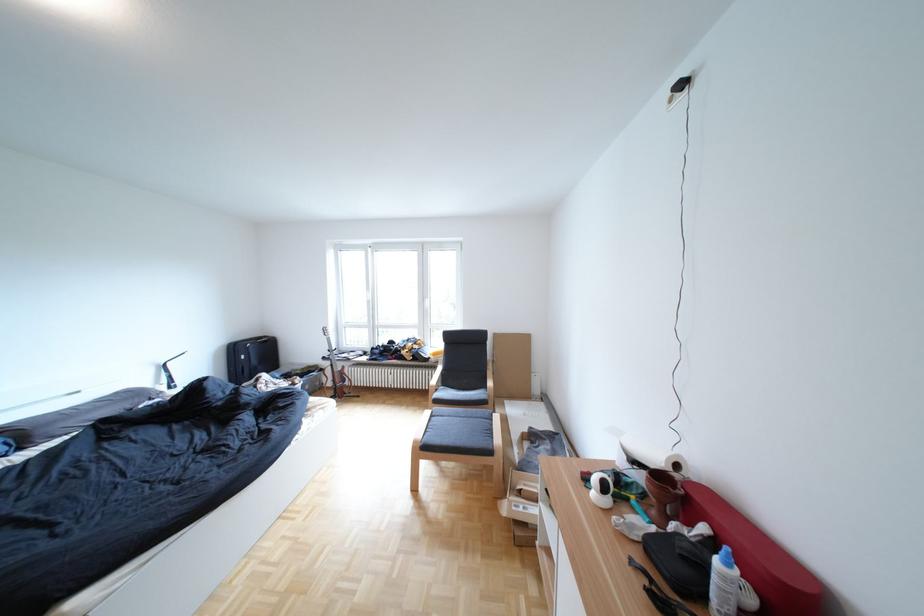
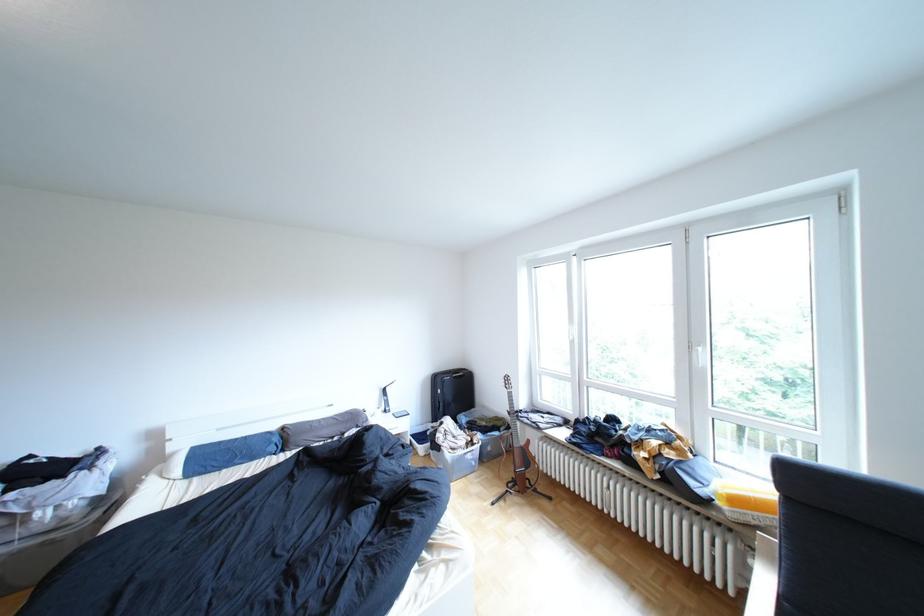
In the second image, find the point that corresponds to point (249, 349) in the first image.

(452, 379)